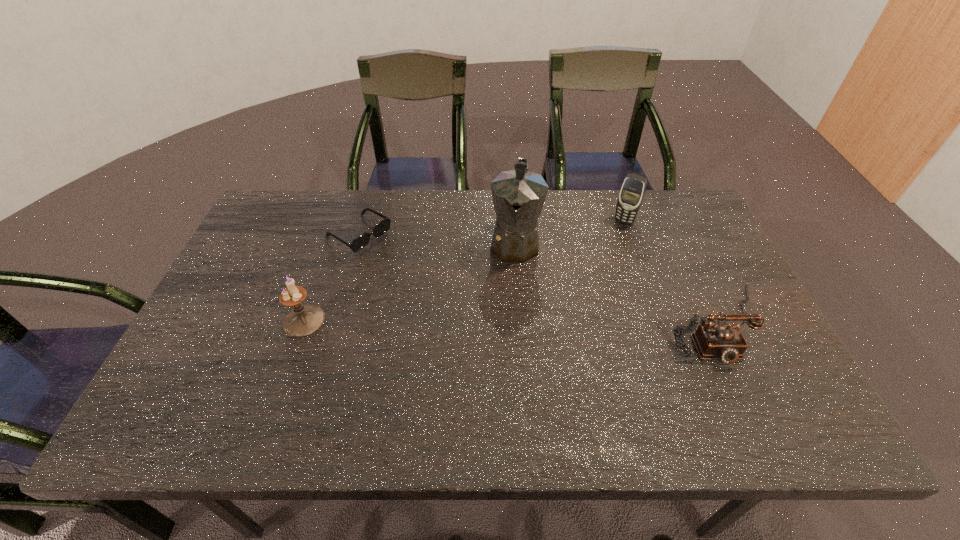
This screenshot has width=960, height=540. What are the coordinates of `vacant space located on the pouring side of the third object from left to right` in the screenshot? It's located at (509, 303).

The image size is (960, 540). In order to click on free spot located 0.200m on the front-facing side of the shortest object in this screenshot , I will do `click(430, 278)`.

Where is `vacant area located 0.150m on the front-facing side of the shortest object`? Image resolution: width=960 pixels, height=540 pixels. vacant area located 0.150m on the front-facing side of the shortest object is located at coordinates (418, 270).

Where is `vacant space located on the front-facing side of the shortest object`? This screenshot has width=960, height=540. vacant space located on the front-facing side of the shortest object is located at coordinates (415, 268).

Where is `free space located 0.060m on the front face of the cellular telephone`? free space located 0.060m on the front face of the cellular telephone is located at coordinates (613, 237).

What are the coordinates of `vacant point located on the front face of the cellular telephone` in the screenshot? It's located at (607, 248).

Identify the location of vacant region located 0.370m on the front face of the cellular telephone. (574, 304).

Identify the location of coffeepot located in the far edge section of the desktop. This screenshot has width=960, height=540. (518, 195).

Identify the location of sunglasses situated at the far edge. (361, 241).

Identify the location of cellular telephone that is at the far edge. (632, 192).